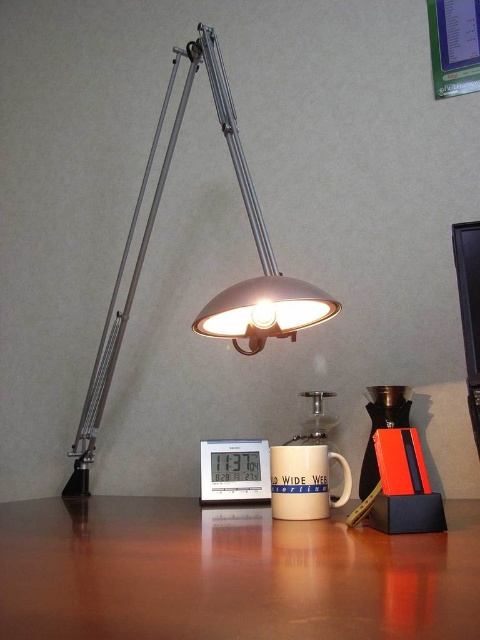
You are standing in front of the desk and want to reach the point marked at coordinates (x=214, y=522). The desk is 1.5 meters wide. Can you estimate whether the point is within the desk area?

The point marked at coordinates (x=214, y=522) is 1.04 meters away from the camera, so it is within the desk area since the desk is 1.5 meters wide.

You are organizing your workspace and need to place a new item between the brown wooden table at center and the black glossy monitor at upper right. Based on their positions, where should you place the item?

Since the brown wooden table at center is to the left of the black glossy monitor at upper right, you should place the new item between them, positioning it to the right of the brown wooden table at center and to the left of the black glossy monitor at upper right.

Looking at this image, you are organizing items on your desk and want to ensure everything fits within the available space. Given the white plastic digital clock at center and the black glossy monitor at upper right, which item takes up more desk space?

The black glossy monitor at upper right takes up more desk space than the white plastic digital clock at center, as the white plastic digital clock at center occupies less space according to the description.